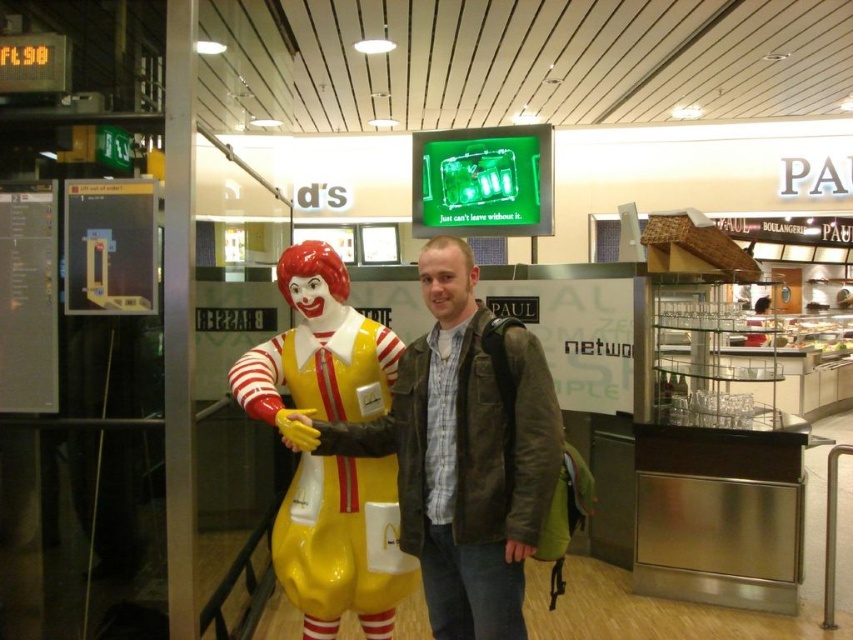
What do you see at coordinates (465, 451) in the screenshot? The height and width of the screenshot is (640, 853). I see `brown leather jacket at center` at bounding box center [465, 451].

Between brown leather jacket at center and yellow glossy clown at center, which one has less height?

brown leather jacket at center

Is point (378, 426) positioned behind point (364, 468)?

No, it is not.

Identify the location of brown leather jacket at center. (465, 451).